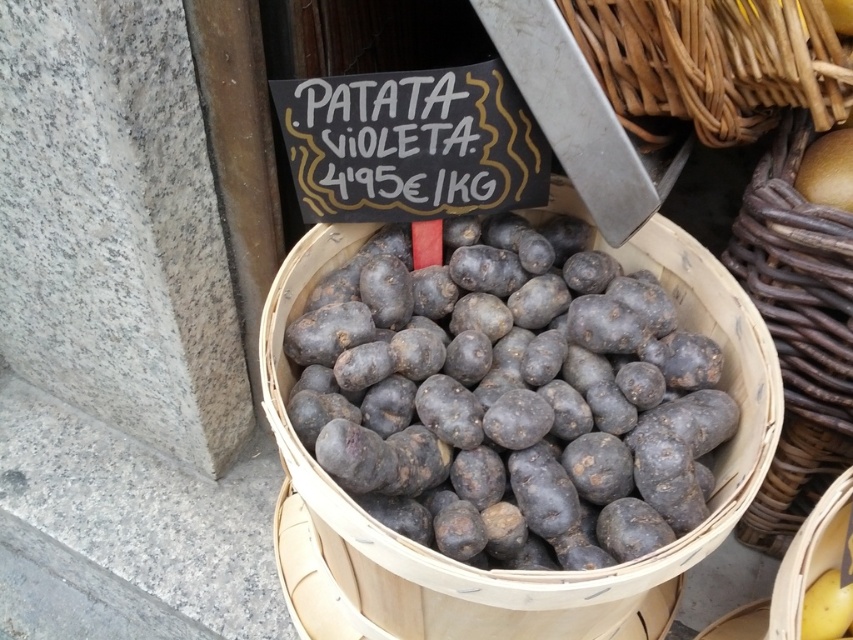
You are a customer at a market stall and want to buy the PATATA VIOLETA. The vendor tells you that the basket with the potatoes is located at the center of the stall. You see a point marked at coordinate (798, 330). Can you confirm if this point corresponds to the rustic wicker basket at center where the PATATA VIOLETA are displayed?

Yes, the point (798, 330) indicates the rustic wicker basket at center, which contains the PATATA VIOLETA potatoes.

You are standing at the market and want to pick up the basket of PATATA VIOLETA. The basket is located at point (424, 394). If your hand can reach up to 30 inches, will you be able to reach the basket?

The point (424, 394) is 31.85 inches from the viewer, which is beyond your hand reach of 30 inches. You will not be able to reach the basket.

You are at a market stall and need to choose a basket to carry your groceries. You have two options in the image, the rustic wicker basket at center and the woven brown basket at upper right. Which basket can hold more items based on their sizes?

The rustic wicker basket at center is bigger than the woven brown basket at upper right, so it can hold more items.